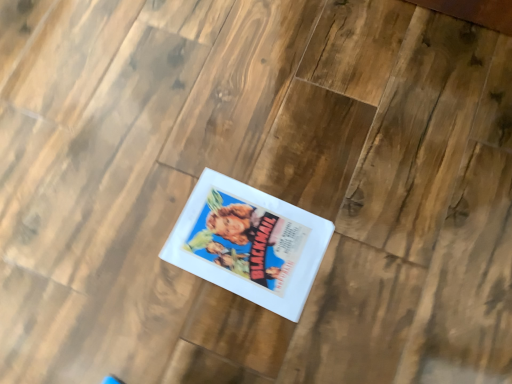
The height and width of the screenshot is (384, 512). I want to click on white glossy paperback book at center, so (249, 243).

The height and width of the screenshot is (384, 512). Describe the element at coordinates (249, 243) in the screenshot. I see `white glossy paperback book at center` at that location.

In order to face white glossy paperback book at center, should I rotate leftwards or rightwards?

It's best to rotate left around 1.012 degrees.

Measure the distance between point (259, 211) and camera.

Point (259, 211) is 86.80 centimeters away from camera.

Find the location of a particular element. This screenshot has height=384, width=512. white glossy paperback book at center is located at coordinates (249, 243).